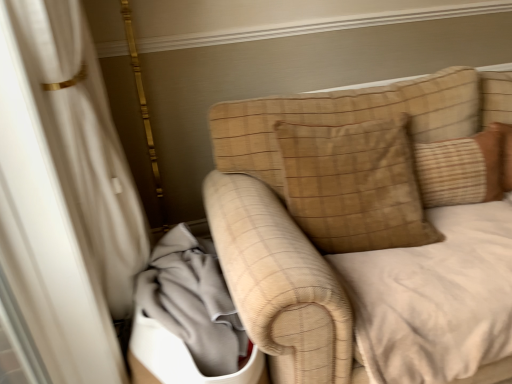
The height and width of the screenshot is (384, 512). Describe the element at coordinates (343, 118) in the screenshot. I see `brown suede pillow at upper right, the second pillow viewed from the right` at that location.

The height and width of the screenshot is (384, 512). What do you see at coordinates (466, 168) in the screenshot? I see `brown textured pillow at upper right, acting as the 1th pillow starting from the right` at bounding box center [466, 168].

What are the coordinates of `gray fabric at lower left` in the screenshot? It's located at (193, 301).

Is brown suede pillow at upper right, the first pillow from the left, touching brown textured pillow at upper right, acting as the 1th pillow starting from the right?

No, brown suede pillow at upper right, the first pillow from the left, is not next to brown textured pillow at upper right, acting as the 1th pillow starting from the right.

Does brown suede pillow at upper right, the first pillow from the left, turn towards brown textured pillow at upper right, which appears as the second pillow when viewed from the left?

No.

I want to click on pillow to the left of brown textured pillow at upper right, acting as the 1th pillow starting from the right, so click(x=343, y=118).

Is the depth of brown suede pillow at upper right, the first pillow from the left, less than that of brown textured pillow at upper right, which appears as the second pillow when viewed from the left?

That is True.

Can you confirm if brown suede pillow at upper right, the second pillow viewed from the right, is bigger than gray fabric at lower left?

Indeed, brown suede pillow at upper right, the second pillow viewed from the right, has a larger size compared to gray fabric at lower left.

Can you confirm if brown suede pillow at upper right, the first pillow from the left, is wider than gray fabric at lower left?

Incorrect, the width of brown suede pillow at upper right, the first pillow from the left, does not surpass that of gray fabric at lower left.

In order to click on the 2nd pillow located above the gray fabric at lower left (from a real-world perspective) in this screenshot , I will do `click(343, 118)`.

What's the angular difference between brown suede pillow at upper right, the second pillow viewed from the right, and gray fabric at lower left's facing directions?

The angular difference between brown suede pillow at upper right, the second pillow viewed from the right, and gray fabric at lower left is 14.8 degrees.

Is brown textured pillow at upper right, acting as the 1th pillow starting from the right, not inside gray fabric at lower left?

That's correct, brown textured pillow at upper right, acting as the 1th pillow starting from the right, is outside of gray fabric at lower left.

Is point (442, 201) positioned before point (205, 339)?

No, (442, 201) is further to viewer.

Looking at the image, does brown textured pillow at upper right, which appears as the second pillow when viewed from the left, seem bigger or smaller compared to gray fabric at lower left?

Clearly, brown textured pillow at upper right, which appears as the second pillow when viewed from the left, is smaller in size than gray fabric at lower left.

Can you confirm if brown textured pillow at upper right, which appears as the second pillow when viewed from the left, is shorter than gray fabric at lower left?

Yes, brown textured pillow at upper right, which appears as the second pillow when viewed from the left, is shorter than gray fabric at lower left.

This screenshot has height=384, width=512. I want to click on pillow below the brown textured pillow at upper right, acting as the 1th pillow starting from the right (from the image's perspective), so (x=343, y=118).

Is brown textured pillow at upper right, which appears as the second pillow when viewed from the left, positioned before brown suede pillow at upper right, the second pillow viewed from the right?

No.

Where is `material in front of the brown suede pillow at upper right, the second pillow viewed from the right`? The image size is (512, 384). material in front of the brown suede pillow at upper right, the second pillow viewed from the right is located at coordinates (193, 301).

Does gray fabric at lower left have a greater width compared to brown suede pillow at upper right, the first pillow from the left?

Yes, gray fabric at lower left is wider than brown suede pillow at upper right, the first pillow from the left.

Is gray fabric at lower left facing away from brown suede pillow at upper right, the second pillow viewed from the right?

That's not correct — gray fabric at lower left is not looking away from brown suede pillow at upper right, the second pillow viewed from the right.

Do you think gray fabric at lower left is within brown textured pillow at upper right, which appears as the second pillow when viewed from the left, or outside of it?

gray fabric at lower left exists outside the volume of brown textured pillow at upper right, which appears as the second pillow when viewed from the left.

Can you tell me how much gray fabric at lower left and brown textured pillow at upper right, acting as the 1th pillow starting from the right, differ in facing direction?

The angle between the facing direction of gray fabric at lower left and the facing direction of brown textured pillow at upper right, acting as the 1th pillow starting from the right, is 13.6 degrees.

From the image's perspective, is gray fabric at lower left located beneath brown textured pillow at upper right, which appears as the second pillow when viewed from the left?

Indeed, from the image's perspective, gray fabric at lower left is shown beneath brown textured pillow at upper right, which appears as the second pillow when viewed from the left.

Which is farther, [150,262] or [440,183]?

Positioned behind is point [440,183].

Where is `pillow behind the brown suede pillow at upper right, the second pillow viewed from the right`? This screenshot has width=512, height=384. pillow behind the brown suede pillow at upper right, the second pillow viewed from the right is located at coordinates (466, 168).

Identify the location of material below the brown suede pillow at upper right, the first pillow from the left (from a real-world perspective). This screenshot has height=384, width=512. (193, 301).

From the image, which object appears to be nearer to gray fabric at lower left, brown textured pillow at upper right, acting as the 1th pillow starting from the right, or brown suede pillow at upper right, the second pillow viewed from the right?

brown suede pillow at upper right, the second pillow viewed from the right, is positioned closer to the anchor gray fabric at lower left.

Which object lies nearer to the anchor point brown suede pillow at upper right, the second pillow viewed from the right, gray fabric at lower left or brown textured pillow at upper right, acting as the 1th pillow starting from the right?

brown textured pillow at upper right, acting as the 1th pillow starting from the right, lies closer to brown suede pillow at upper right, the second pillow viewed from the right, than the other object.

Which object lies further to the anchor point brown textured pillow at upper right, acting as the 1th pillow starting from the right, gray fabric at lower left or brown suede pillow at upper right, the first pillow from the left?

Based on the image, gray fabric at lower left appears to be further to brown textured pillow at upper right, acting as the 1th pillow starting from the right.

From the image, which object appears to be nearer to brown suede pillow at upper right, the second pillow viewed from the right, brown textured pillow at upper right, which appears as the second pillow when viewed from the left, or gray fabric at lower left?

Based on the image, brown textured pillow at upper right, which appears as the second pillow when viewed from the left, appears to be nearer to brown suede pillow at upper right, the second pillow viewed from the right.

From the image, which object appears to be farther from gray fabric at lower left, brown suede pillow at upper right, the second pillow viewed from the right, or brown textured pillow at upper right, acting as the 1th pillow starting from the right?

brown textured pillow at upper right, acting as the 1th pillow starting from the right, lies further to gray fabric at lower left than the other object.

Looking at the image, which one is located closer to brown textured pillow at upper right, which appears as the second pillow when viewed from the left, brown suede pillow at upper right, the first pillow from the left, or gray fabric at lower left?

brown suede pillow at upper right, the first pillow from the left, is positioned closer to the anchor brown textured pillow at upper right, which appears as the second pillow when viewed from the left.

What are the coordinates of `pillow between gray fabric at lower left and brown textured pillow at upper right, which appears as the second pillow when viewed from the left, from left to right` in the screenshot? It's located at (343, 118).